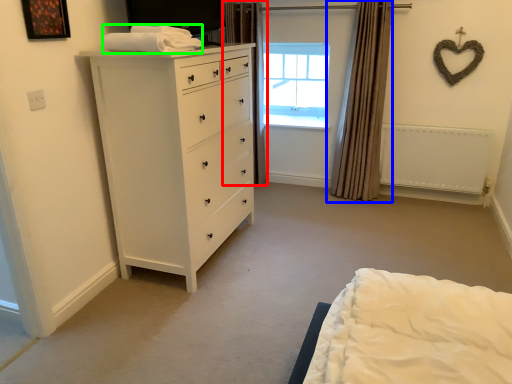
Question: Which object is the closest to the curtain (highlighted by a red box)? Choose among these: curtain (highlighted by a blue box) or blanket (highlighted by a green box).

Choices:
 (A) curtain
 (B) blanket

Answer: (A)